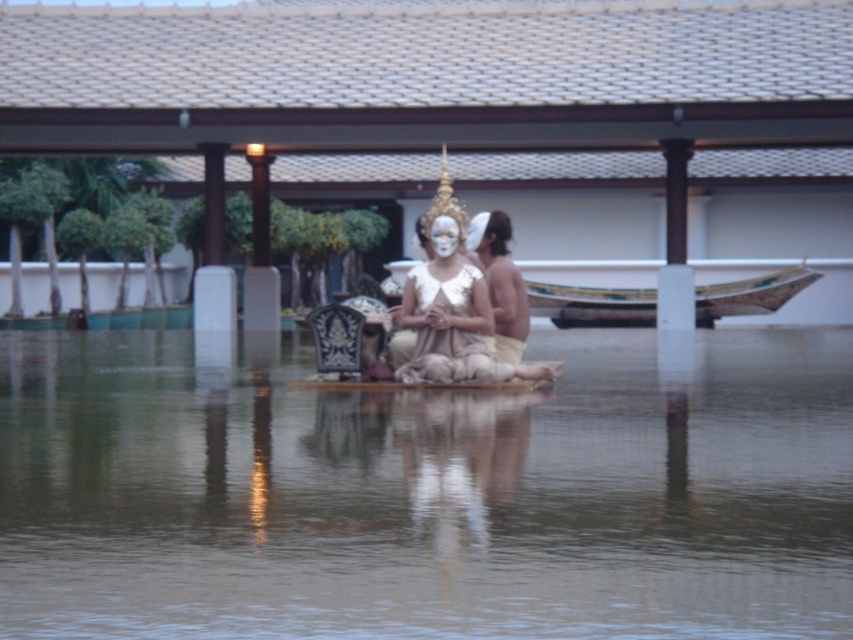
Is the position of brown matte wood at center more distant than that of white matte face at center?

No.

Between brown matte wood at center and white matte face at center, which one has less height?

white matte face at center is shorter.

Between point (351, 435) and point (436, 221), which one is positioned behind?

Point (436, 221)

I want to click on brown matte wood at center, so click(427, 493).